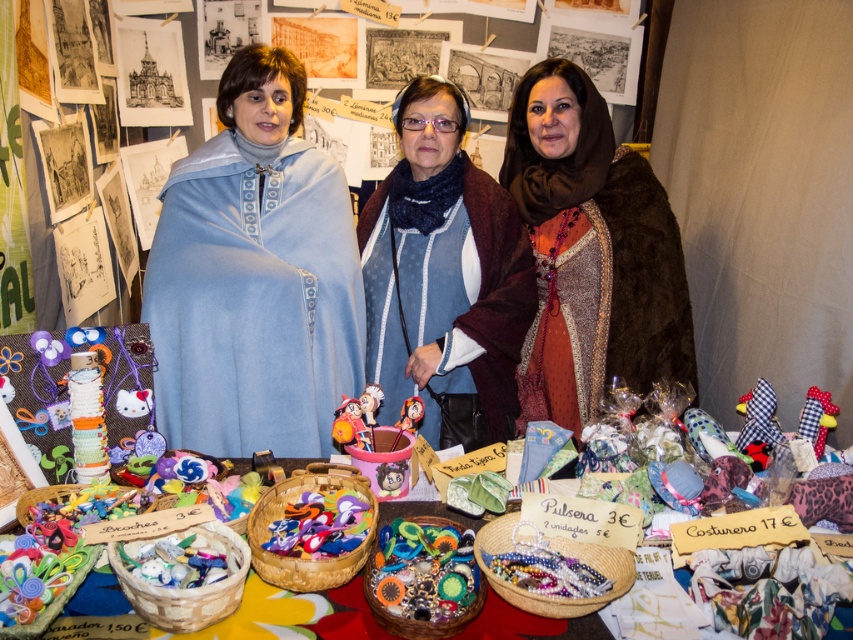
Who is more distant from viewer, (465, 376) or (407, 403)?

Point (465, 376)

Does blue woolen scarf at center have a lesser width compared to plush fabric toy at center?

Incorrect, blue woolen scarf at center's width is not less than plush fabric toy at center's.

What do you see at coordinates (444, 269) in the screenshot? Image resolution: width=853 pixels, height=640 pixels. I see `blue woolen scarf at center` at bounding box center [444, 269].

Locate an element on the screen. Image resolution: width=853 pixels, height=640 pixels. blue woolen scarf at center is located at coordinates (444, 269).

The height and width of the screenshot is (640, 853). What do you see at coordinates (254, 276) in the screenshot?
I see `matte blue fabric at center` at bounding box center [254, 276].

The width and height of the screenshot is (853, 640). Find the location of `matte blue fabric at center`. matte blue fabric at center is located at coordinates (254, 276).

Which is in front, point (326, 394) or point (344, 621)?

Point (344, 621) is more forward.

Where is `matte blue fabric at center`? matte blue fabric at center is located at coordinates (254, 276).

Who is positioned more to the right, matte blue fabric at center or brown fur coat at center?

brown fur coat at center

Between matte blue fabric at center and brown fur coat at center, which one is positioned lower?

matte blue fabric at center is below.

You are a GUI agent. You are given a task and a screenshot of the screen. Output one action in this format:
    pyautogui.click(x=<x>, y=<y>)
    Task: Click on the matte blue fabric at center
    
    Given the screenshot: What is the action you would take?
    pyautogui.click(x=254, y=276)